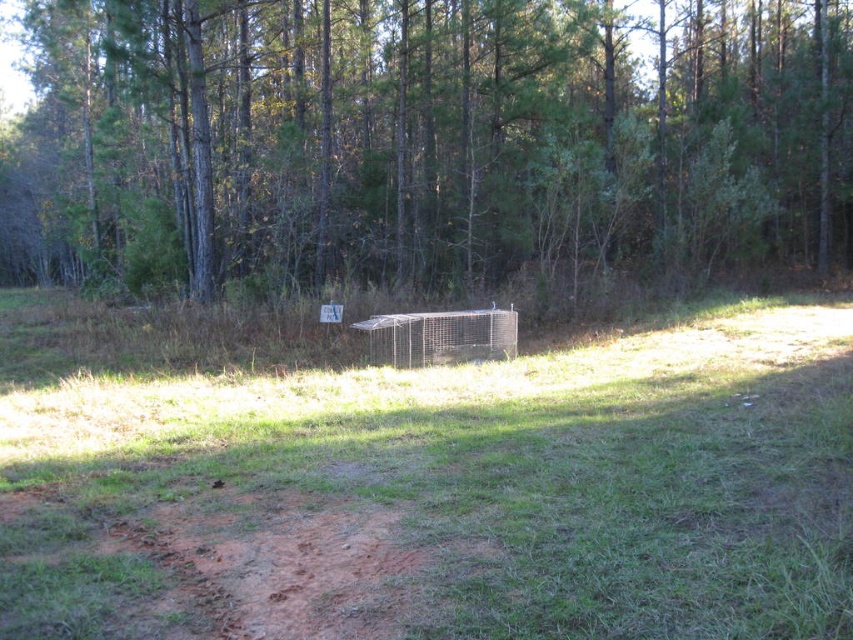
Question: Does green grass at center have a lesser width compared to brown wood tree at center?

Choices:
 (A) no
 (B) yes

Answer: (B)

Question: Does green grass at center come in front of brown wood tree at center?

Choices:
 (A) no
 (B) yes

Answer: (B)

Question: Which object appears closest to the camera in this image?

Choices:
 (A) green grass at center
 (B) brown wood tree at center

Answer: (A)

Question: Does green grass at center appear on the right side of brown wood tree at center?

Choices:
 (A) no
 (B) yes

Answer: (B)

Question: Which point is farther from the camera taking this photo?

Choices:
 (A) (413, 77)
 (B) (242, 388)

Answer: (A)